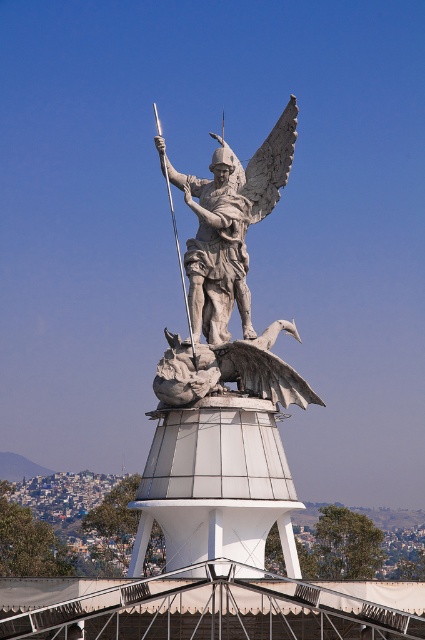
Between white stone statue at center and polished silver spear at center, which one appears on the right side from the viewer's perspective?

Positioned to the right is white stone statue at center.

The width and height of the screenshot is (425, 640). In order to click on white stone statue at center in this screenshot , I will do `click(223, 381)`.

I want to click on white stone statue at center, so click(223, 381).

Identify the location of polished stone angel at center. Image resolution: width=425 pixels, height=640 pixels. (231, 225).

Which is in front, point (254, 332) or point (183, 276)?

Point (254, 332) is more forward.

You are a GUI agent. You are given a task and a screenshot of the screen. Output one action in this format:
    pyautogui.click(x=<x>, y=<y>)
    Task: Click on the polished stone angel at center
    
    Given the screenshot: What is the action you would take?
    pyautogui.click(x=231, y=225)

Who is lower down, white stone statue at center or polished stone angel at center?

white stone statue at center

How far apart are white stone statue at center and polished stone angel at center?

white stone statue at center is 18.47 feet from polished stone angel at center.

Measure the distance between white stone statue at center and camera.

white stone statue at center and camera are 97.89 meters apart.

Locate an element on the screen. white stone statue at center is located at coordinates (223, 381).